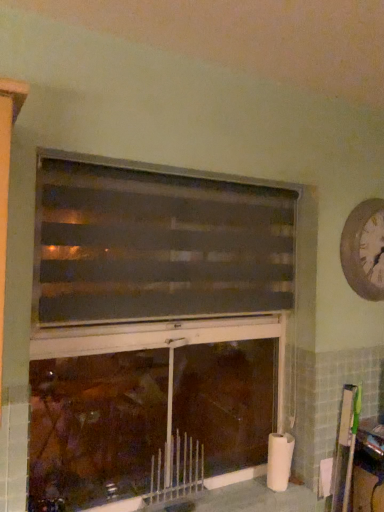
Question: From the image's perspective, would you say dark brown textured blinds at center is shown under white textured clock at upper right?

Choices:
 (A) yes
 (B) no

Answer: (A)

Question: Does dark brown textured blinds at center have a lesser height compared to white textured clock at upper right?

Choices:
 (A) yes
 (B) no

Answer: (B)

Question: From the image's perspective, is dark brown textured blinds at center above white textured clock at upper right?

Choices:
 (A) yes
 (B) no

Answer: (B)

Question: Considering the relative positions of dark brown textured blinds at center and white textured clock at upper right in the image provided, is dark brown textured blinds at center to the left of white textured clock at upper right from the viewer's perspective?

Choices:
 (A) yes
 (B) no

Answer: (A)

Question: Is the position of dark brown textured blinds at center more distant than that of white textured clock at upper right?

Choices:
 (A) no
 (B) yes

Answer: (A)

Question: Considering the relative positions of metallic silver radiator at lower center and wooden bulletin board at right in the image provided, is metallic silver radiator at lower center to the left or to the right of wooden bulletin board at right?

Choices:
 (A) right
 (B) left

Answer: (B)

Question: From their relative heights in the image, would you say metallic silver radiator at lower center is taller or shorter than wooden bulletin board at right?

Choices:
 (A) short
 (B) tall

Answer: (A)

Question: Looking at their shapes, would you say metallic silver radiator at lower center is wider or thinner than wooden bulletin board at right?

Choices:
 (A) wide
 (B) thin

Answer: (A)

Question: Considering the positions of metallic silver radiator at lower center and wooden bulletin board at right in the image, is metallic silver radiator at lower center bigger or smaller than wooden bulletin board at right?

Choices:
 (A) small
 (B) big

Answer: (B)

Question: In terms of size, does dark brown textured blinds at center appear bigger or smaller than white textured clock at upper right?

Choices:
 (A) big
 (B) small

Answer: (A)

Question: From a real-world perspective, relative to white textured clock at upper right, is dark brown textured blinds at center vertically above or below?

Choices:
 (A) below
 (B) above

Answer: (A)

Question: Is point (178, 176) closer or farther from the camera than point (370, 220)?

Choices:
 (A) farther
 (B) closer

Answer: (B)

Question: Relative to white textured clock at upper right, is dark brown textured blinds at center in front or behind?

Choices:
 (A) front
 (B) behind

Answer: (A)

Question: From a real-world perspective, is white textured clock at upper right positioned above or below metallic silver radiator at lower center?

Choices:
 (A) below
 (B) above

Answer: (B)

Question: Visually, is white textured clock at upper right positioned to the left or to the right of metallic silver radiator at lower center?

Choices:
 (A) right
 (B) left

Answer: (A)